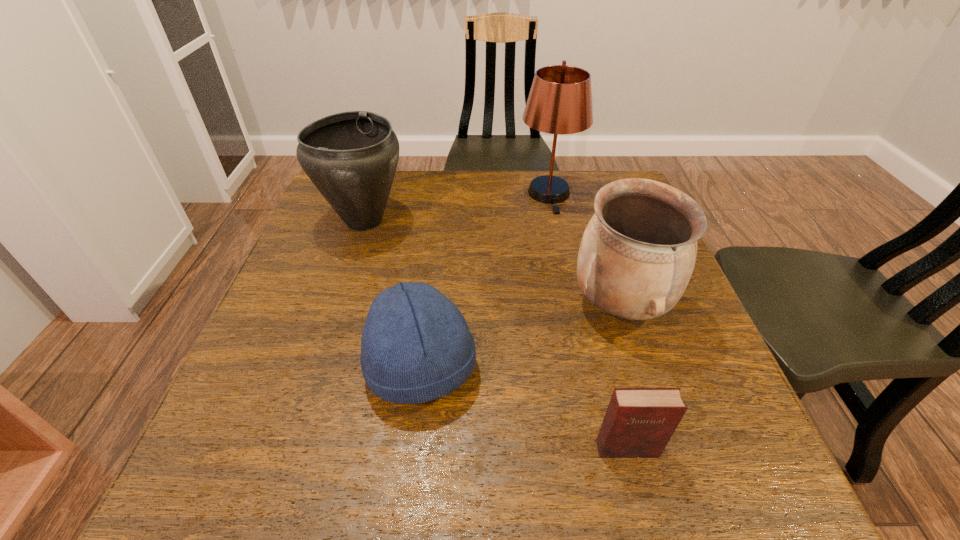
Locate which object ranks fourth in proximity to the nearest object. Please provide its 2D coordinates. Your answer should be formatted as a tuple, i.e. [(x, y)], where the tuple contains the x and y coordinates of a point satisfying the conditions above.

[(560, 100)]

At what (x,y) coordinates should I click in order to perform the action: click on free space that satisfies the following two spatial constraints: 1. on the front side of the nearer urn; 2. on the right side of the farther urn. Please return your answer as a coordinate pair (x, y). Looking at the image, I should click on (337, 305).